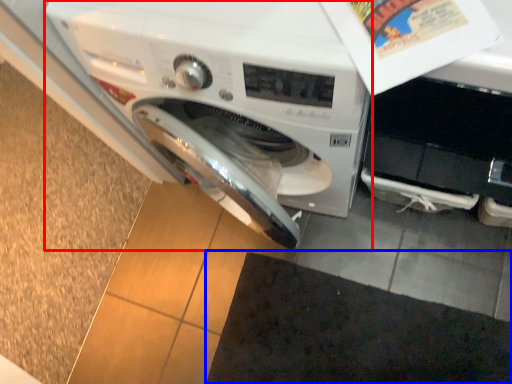
Question: Which of the following is the closest to the observer, washing machine (highlighted by a red box) or doormat (highlighted by a blue box)?

Choices:
 (A) washing machine
 (B) doormat

Answer: (A)